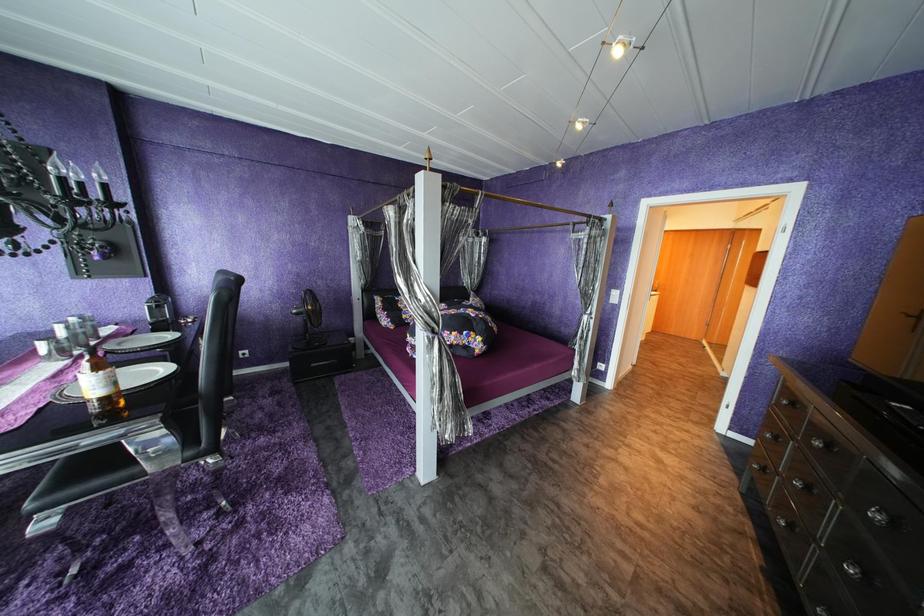
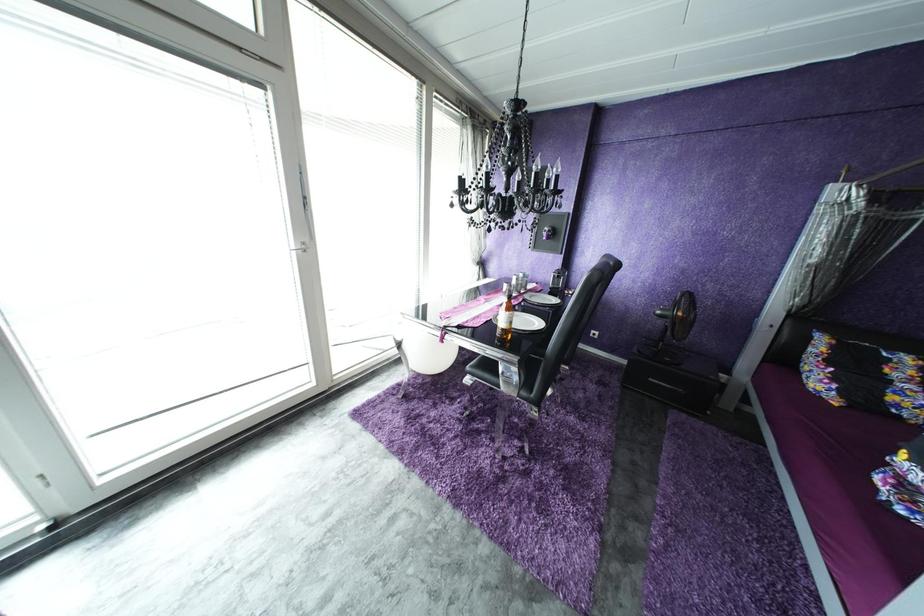
Question: The camera is either moving clockwise (left) or counter-clockwise (right) around the object. The first image is from the beginning of the video and the second image is from the end. Is the camera moving left or right when shooting the video?

Choices:
 (A) Left
 (B) Right

Answer: (B)